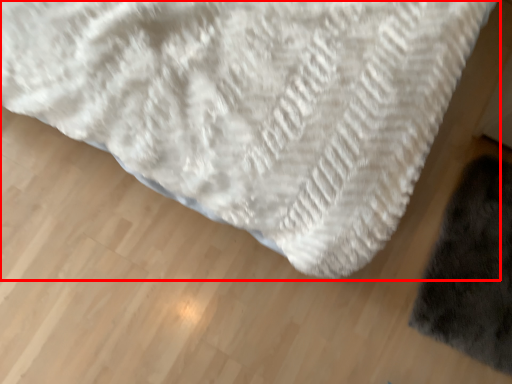
Question: From the image's perspective, where is towel (annotated by the red box) located relative to mat?

Choices:
 (A) above
 (B) below

Answer: (A)